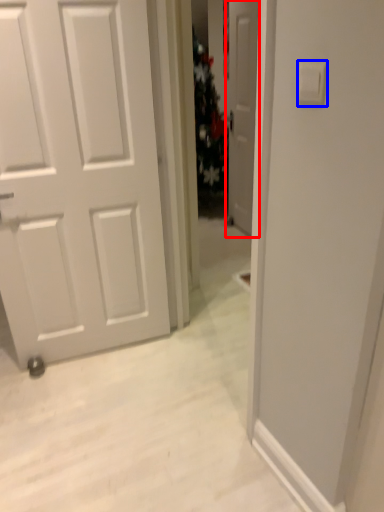
Question: Which object is further to the camera taking this photo, door (highlighted by a red box) or light switch (highlighted by a blue box)?

Choices:
 (A) door
 (B) light switch

Answer: (A)